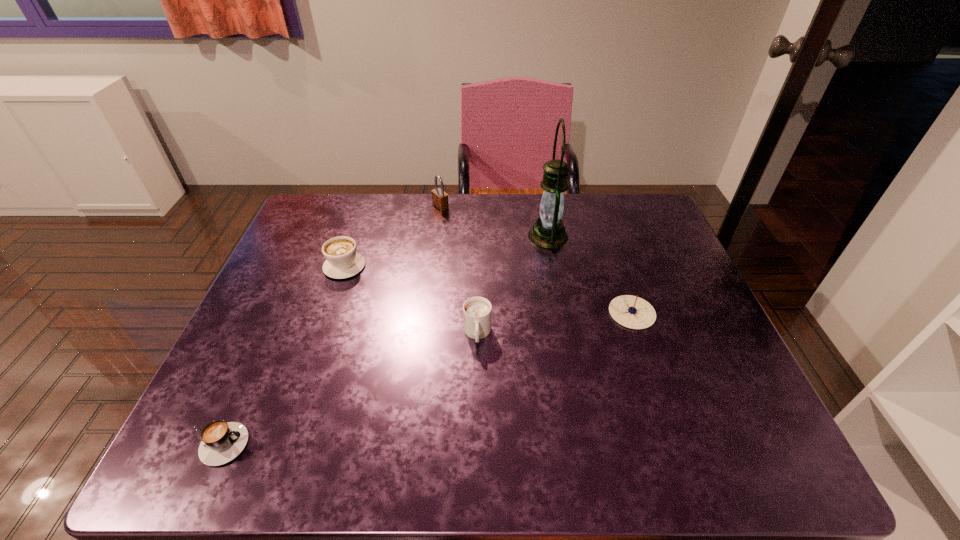
Where is `free location located 0.150m on the left of the compass`? The width and height of the screenshot is (960, 540). free location located 0.150m on the left of the compass is located at coordinates (548, 313).

You are a GUI agent. You are given a task and a screenshot of the screen. Output one action in this format:
    pyautogui.click(x=<x>, y=<y>)
    Task: Click on the free space located 0.230m with the handle on the side of the nearest object
    
    Given the screenshot: What is the action you would take?
    pyautogui.click(x=368, y=444)

I want to click on lantern situated at the far edge, so click(x=548, y=231).

Locate an element on the screen. This screenshot has width=960, height=540. padlock located at the far edge is located at coordinates pos(439,198).

Locate an element on the screen. object located in the near edge section of the desktop is located at coordinates (221, 442).

Locate an element on the screen. This screenshot has width=960, height=540. object present at the right edge is located at coordinates (632, 312).

This screenshot has height=540, width=960. I want to click on object positioned at the near left corner, so click(x=221, y=442).

The image size is (960, 540). Find the location of `vacant point at the far edge`. vacant point at the far edge is located at coordinates (590, 223).

Where is `free space at the near edge of the desktop`? The width and height of the screenshot is (960, 540). free space at the near edge of the desktop is located at coordinates (315, 435).

Image resolution: width=960 pixels, height=540 pixels. I want to click on free space at the left edge, so click(256, 325).